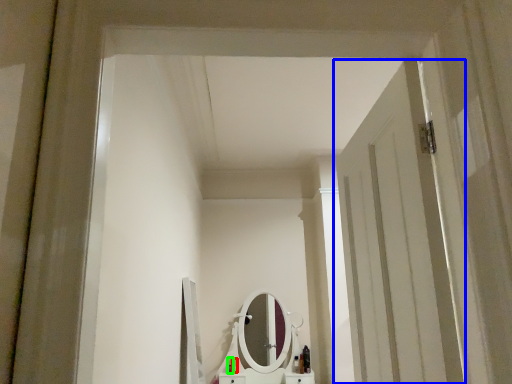
Question: Estimate the real-world distances between objects in this image. Which object is closer to toiletry (highlighted by a red box), door (highlighted by a blue box) or toiletry (highlighted by a green box)?

Choices:
 (A) door
 (B) toiletry

Answer: (B)